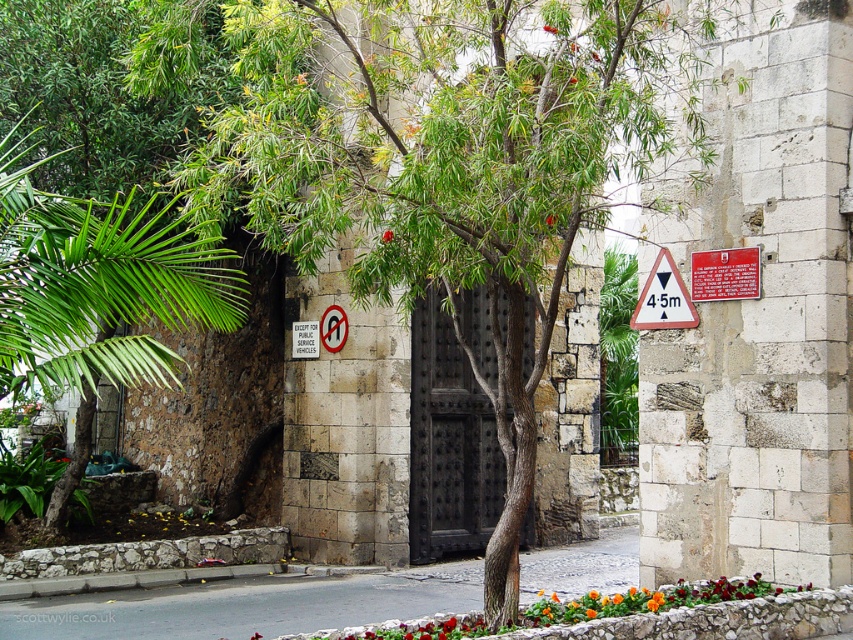
You are standing in front of the historic stone building and notice two signs at the center. Which one is nearer to you, the metallic rectangular sign at center or the white paper sign at center?

The metallic rectangular sign at center is closer to the viewer than the white paper sign at center.

You are standing in front of the historic stone building and notice two points marked on the gate. The first point is at coordinate point (x=354, y=180) and the second is at point (x=389, y=234). Which point is nearer to your current position?

Point (x=354, y=180) is closer to the camera than point (x=389, y=234), so the first point is nearer to your current position.

You are standing in front of the historic stone building and want to find the entrance. According to the image, where is the black wrought iron door at center located in terms of its 2D coordinates?

The black wrought iron door at center is located at the 2D coordinates of point (x=448, y=442).